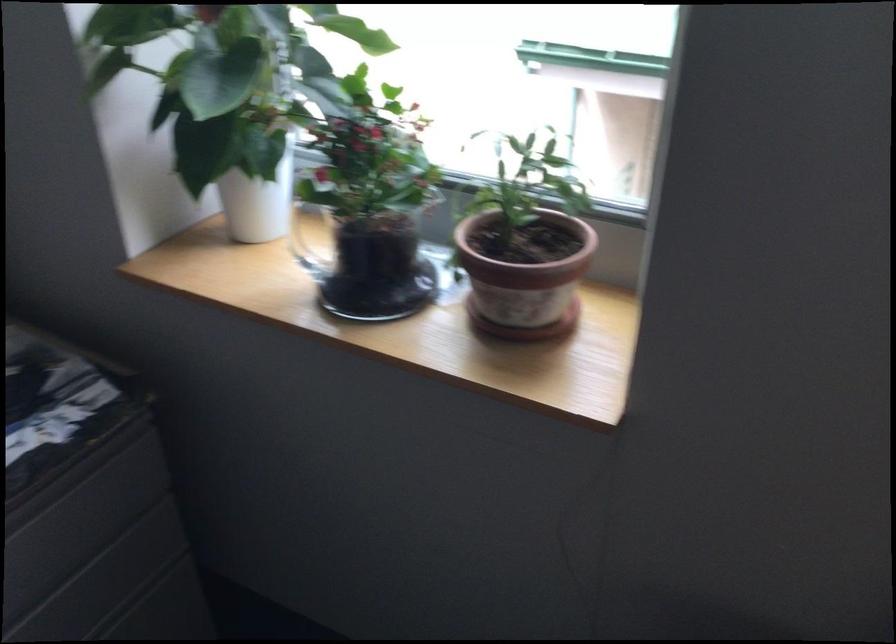
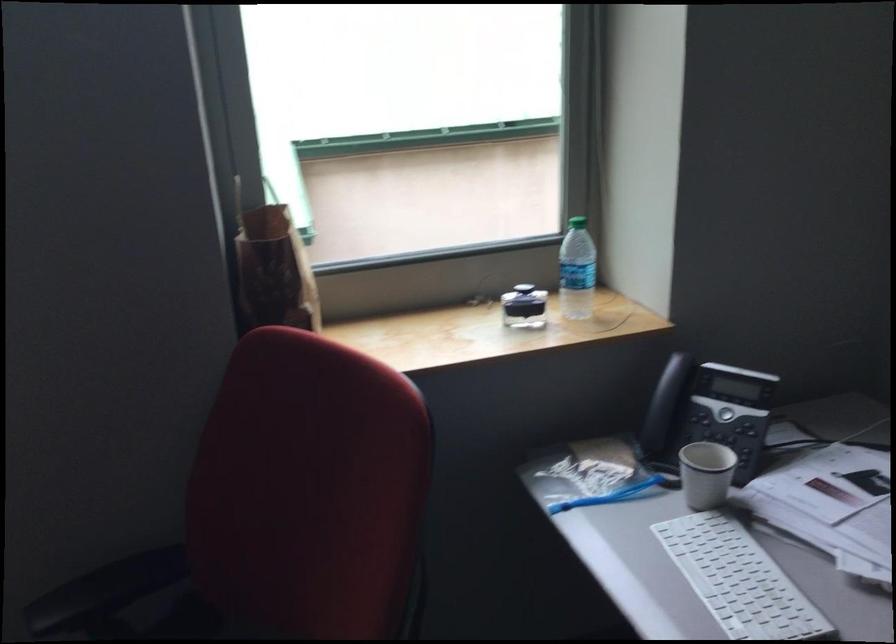
Question: The camera is either moving clockwise (left) or counter-clockwise (right) around the object. The first image is from the beginning of the video and the second image is from the end. Is the camera moving left or right when shooting the video?

Choices:
 (A) Left
 (B) Right

Answer: (A)